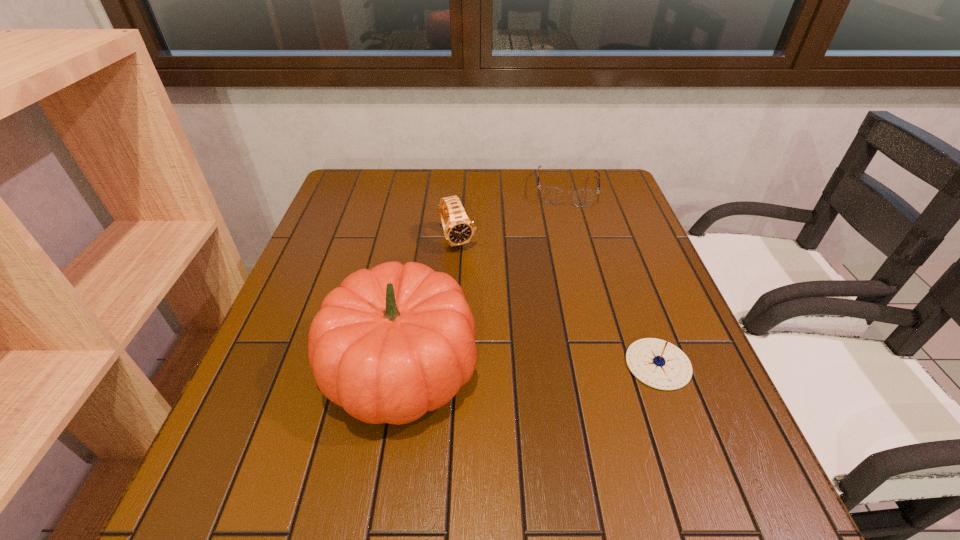
Where is `blank space at the far edge`? This screenshot has width=960, height=540. blank space at the far edge is located at coordinates (396, 190).

The image size is (960, 540). What are the coordinates of `vacant space at the near edge of the desktop` in the screenshot? It's located at (482, 443).

This screenshot has width=960, height=540. Find the location of `vacant space at the left edge of the desktop`. vacant space at the left edge of the desktop is located at coordinates (371, 228).

Identify the location of vacant space at the right edge of the desktop. (x=638, y=256).

Locate an element on the screen. The height and width of the screenshot is (540, 960). free space at the far left corner is located at coordinates (385, 192).

Find the location of a particular element. The height and width of the screenshot is (540, 960). free area in between the second tallest object and the spectacles is located at coordinates (512, 215).

Find the location of a particular element. The width and height of the screenshot is (960, 540). free spot between the compass and the tallest object is located at coordinates (530, 366).

Identify the location of free area in between the compass and the farthest object. This screenshot has width=960, height=540. click(612, 277).

This screenshot has width=960, height=540. What are the coordinates of `unoccupied area between the second farthest object and the farthest object` in the screenshot? It's located at (512, 215).

Locate an element on the screen. This screenshot has width=960, height=540. empty space that is in between the compass and the pumpkin is located at coordinates (530, 366).